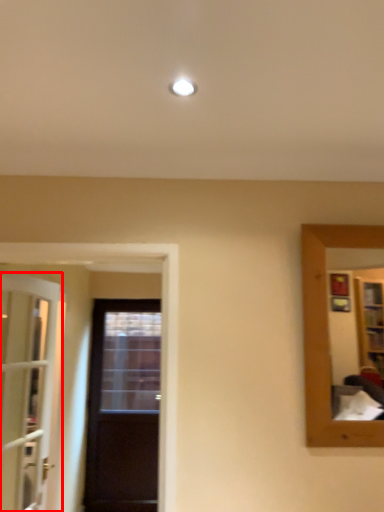
Question: From the image's perspective, where is door (annotated by the red box) located relative to door?

Choices:
 (A) above
 (B) below

Answer: (A)